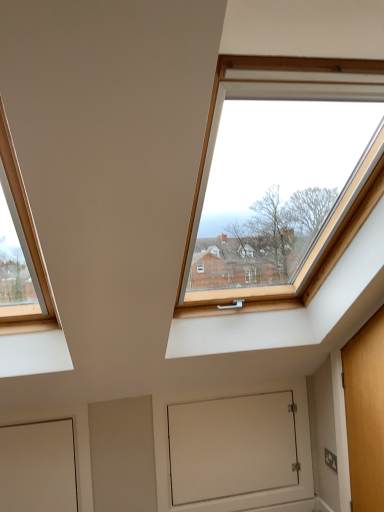
This screenshot has width=384, height=512. I want to click on white matte door at lower center, so click(x=232, y=447).

Find the location of `white matte door at lower left, the 2th door in the right-to-left sequence`. white matte door at lower left, the 2th door in the right-to-left sequence is located at coordinates (38, 467).

The image size is (384, 512). What are the coordinates of `white matte door at lower center` in the screenshot? It's located at (232, 447).

Would you say white matte door at lower center is to the left or to the right of white matte door at lower left, the first door from the left, in the picture?

Based on their positions, white matte door at lower center is located to the right of white matte door at lower left, the first door from the left.

From the image's perspective, which one is positioned higher, white matte door at lower center or white matte door at lower left, the first door from the left?

white matte door at lower left, the first door from the left.

Looking at this image, is white matte door at lower left, the 2th door in the right-to-left sequence, completely or partially inside white matte door at lower center?

That's incorrect, white matte door at lower left, the 2th door in the right-to-left sequence, is not inside white matte door at lower center.

From the image's perspective, is white matte door at lower center below wooden door at right, marked as the 1th door in a right-to-left arrangement?

Yes, from the image's perspective, white matte door at lower center is beneath wooden door at right, marked as the 1th door in a right-to-left arrangement.

The width and height of the screenshot is (384, 512). I want to click on window screen below the wooden door at right, marked as the 1th door in a right-to-left arrangement (from the image's perspective), so click(x=232, y=447).

From a real-world perspective, which is physically below, white matte door at lower center or wooden door at right, the second door viewed from the left?

From a 3D spatial view, white matte door at lower center is below.

Is white matte door at lower center inside white matte door at lower left, the 2th door in the right-to-left sequence?

Definitely not — white matte door at lower center is not inside white matte door at lower left, the 2th door in the right-to-left sequence.

Is white matte door at lower left, the first door from the left, bigger than white matte door at lower center?

Actually, white matte door at lower left, the first door from the left, might be smaller than white matte door at lower center.

Could you tell me if white matte door at lower left, the 2th door in the right-to-left sequence, is facing white matte door at lower center?

No.

From the image's perspective, is white matte door at lower left, the 2th door in the right-to-left sequence, on white matte door at lower center?

Correct, white matte door at lower left, the 2th door in the right-to-left sequence, appears higher than white matte door at lower center in the image.

Is white matte door at lower left, the 2th door in the right-to-left sequence, positioned behind wooden door at right, the second door viewed from the left?

Yes, it is.

From the image's perspective, is white matte door at lower left, the first door from the left, above or below wooden door at right, marked as the 1th door in a right-to-left arrangement?

Clearly, from the image's perspective, white matte door at lower left, the first door from the left, is below wooden door at right, marked as the 1th door in a right-to-left arrangement.

Looking at this image, from a real-world perspective, is white matte door at lower left, the 2th door in the right-to-left sequence, above or below wooden door at right, marked as the 1th door in a right-to-left arrangement?

In terms of real-world spatial position, white matte door at lower left, the 2th door in the right-to-left sequence, is below wooden door at right, marked as the 1th door in a right-to-left arrangement.

Which is nearer, (356, 368) or (238, 457)?

Clearly, point (356, 368) is closer to the camera than point (238, 457).

How many degrees apart are the facing directions of wooden door at right, the second door viewed from the left, and white matte door at lower center?

They differ by 90 degrees in their facing directions.

Considering the positions of objects wooden door at right, the second door viewed from the left, and white matte door at lower center in the image provided, who is behind, wooden door at right, the second door viewed from the left, or white matte door at lower center?

white matte door at lower center.

Is white matte door at lower center inside wooden door at right, marked as the 1th door in a right-to-left arrangement?

No, white matte door at lower center is located outside of wooden door at right, marked as the 1th door in a right-to-left arrangement.

Looking at this image, in terms of height, does wooden door at right, the second door viewed from the left, look taller or shorter compared to white matte door at lower left, the first door from the left?

In the image, wooden door at right, the second door viewed from the left, appears to be taller than white matte door at lower left, the first door from the left.

Is wooden door at right, marked as the 1th door in a right-to-left arrangement, to the left of white matte door at lower left, the first door from the left, from the viewer's perspective?

No.

Locate an element on the screen. The image size is (384, 512). door above the white matte door at lower left, the first door from the left (from the image's perspective) is located at coordinates (365, 413).

Is wooden door at right, the second door viewed from the left, oriented away from white matte door at lower left, the first door from the left?

No, wooden door at right, the second door viewed from the left, is not facing away from white matte door at lower left, the first door from the left.

At what (x,y) coordinates should I click in order to perform the action: click on window screen behind the white matte door at lower left, the first door from the left. Please return your answer as a coordinate pair (x, y). Image resolution: width=384 pixels, height=512 pixels. Looking at the image, I should click on (232, 447).

Identify the location of window screen below the wooden door at right, the second door viewed from the left (from a real-world perspective). This screenshot has width=384, height=512. pyautogui.click(x=232, y=447).

Looking at the image, which one is located further to wooden door at right, the second door viewed from the left, white matte door at lower center or white matte door at lower left, the first door from the left?

white matte door at lower left, the first door from the left, is positioned further to the anchor wooden door at right, the second door viewed from the left.

Estimate the real-world distances between objects in this image. Which object is further from white matte door at lower left, the 2th door in the right-to-left sequence, white matte door at lower center or wooden door at right, marked as the 1th door in a right-to-left arrangement?

Based on the image, wooden door at right, marked as the 1th door in a right-to-left arrangement, appears to be further to white matte door at lower left, the 2th door in the right-to-left sequence.

When comparing their distances from white matte door at lower center, does white matte door at lower left, the first door from the left, or wooden door at right, marked as the 1th door in a right-to-left arrangement, seem closer?

Among the two, wooden door at right, marked as the 1th door in a right-to-left arrangement, is located nearer to white matte door at lower center.

Based on their spatial positions, is white matte door at lower left, the 2th door in the right-to-left sequence, or white matte door at lower center further from wooden door at right, the second door viewed from the left?

white matte door at lower left, the 2th door in the right-to-left sequence, is further to wooden door at right, the second door viewed from the left.

Looking at the image, which one is located further to white matte door at lower left, the 2th door in the right-to-left sequence, wooden door at right, the second door viewed from the left, or white matte door at lower center?

wooden door at right, the second door viewed from the left, is positioned further to the anchor white matte door at lower left, the 2th door in the right-to-left sequence.

Estimate the real-world distances between objects in this image. Which object is closer to white matte door at lower center, wooden door at right, marked as the 1th door in a right-to-left arrangement, or white matte door at lower left, the first door from the left?

The object closer to white matte door at lower center is wooden door at right, marked as the 1th door in a right-to-left arrangement.

I want to click on window screen situated between white matte door at lower left, the 2th door in the right-to-left sequence, and wooden door at right, the second door viewed from the left, from left to right, so click(x=232, y=447).